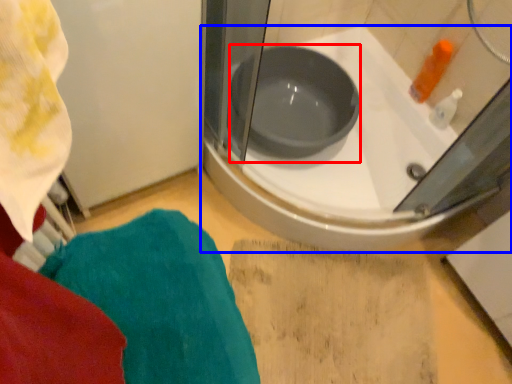
Question: Which point is further to the camera, basin (highlighted by a red box) or bathtub (highlighted by a blue box)?

Choices:
 (A) basin
 (B) bathtub

Answer: (A)